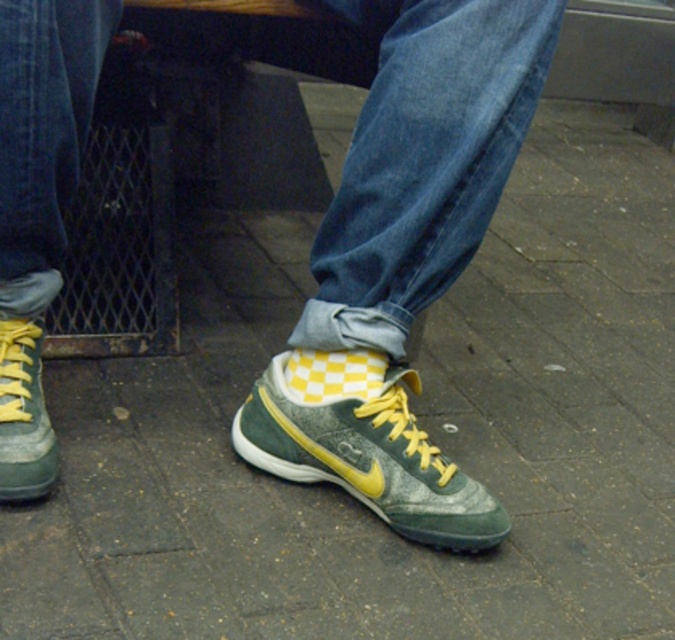
Question: Which point is closer to the camera taking this photo?

Choices:
 (A) (0, 380)
 (B) (375, 429)

Answer: (A)

Question: Can you confirm if green textured sneakers at center is bigger than green suede sneaker at center?

Choices:
 (A) yes
 (B) no

Answer: (A)

Question: Which is farther from the green suede sneaker at center?

Choices:
 (A) green textured sneakers at center
 (B) green suede shoe at lower left

Answer: (B)

Question: Is green textured sneakers at center bigger than green suede shoe at lower left?

Choices:
 (A) no
 (B) yes

Answer: (B)

Question: Which point is farther to the camera?

Choices:
 (A) green suede shoe at lower left
 (B) green textured sneakers at center

Answer: (A)

Question: Is green textured sneakers at center smaller than green suede sneaker at center?

Choices:
 (A) no
 (B) yes

Answer: (A)